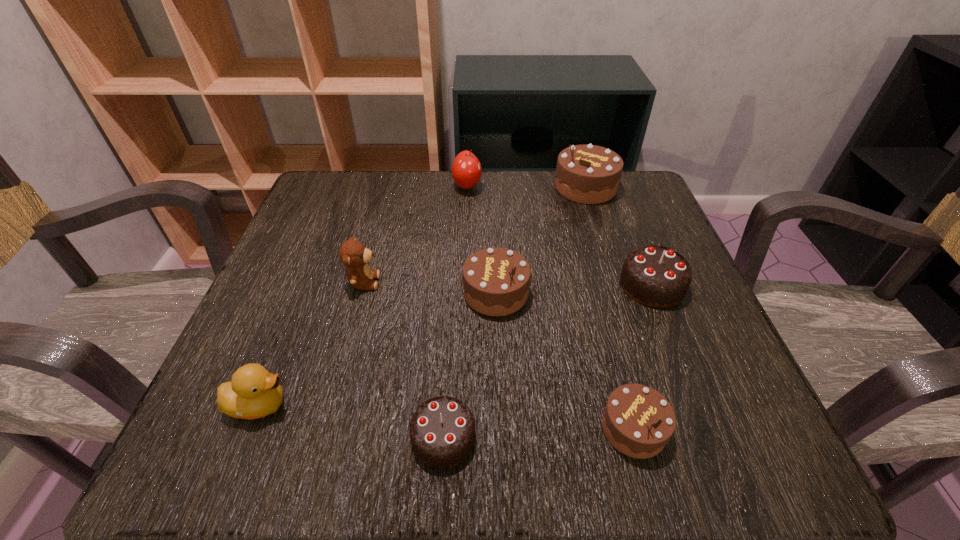
Locate an element on the screen. The image size is (960, 540). free point that satisfies the following two spatial constraints: 1. on the front side of the second nearest brown chocolate cake; 2. facing forward on the duckling is located at coordinates (500, 404).

Locate an element on the screen. The image size is (960, 540). vacant area that satisfies the following two spatial constraints: 1. on the face of the second object from left to right; 2. on the back side of the smaller chocolate chocolate cake is located at coordinates (323, 437).

This screenshot has height=540, width=960. What are the coordinates of `vacant area in the image that satisfies the following two spatial constraints: 1. on the front side of the biggest brown chocolate cake; 2. facing forward on the leftmost object` in the screenshot? It's located at (653, 404).